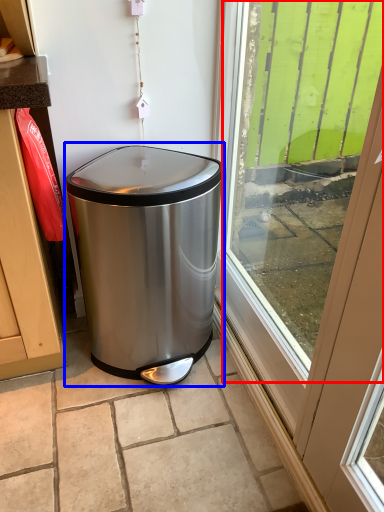
Question: Which of the following is the closest to the observer, window screen (highlighted by a red box) or waste container (highlighted by a blue box)?

Choices:
 (A) window screen
 (B) waste container

Answer: (A)